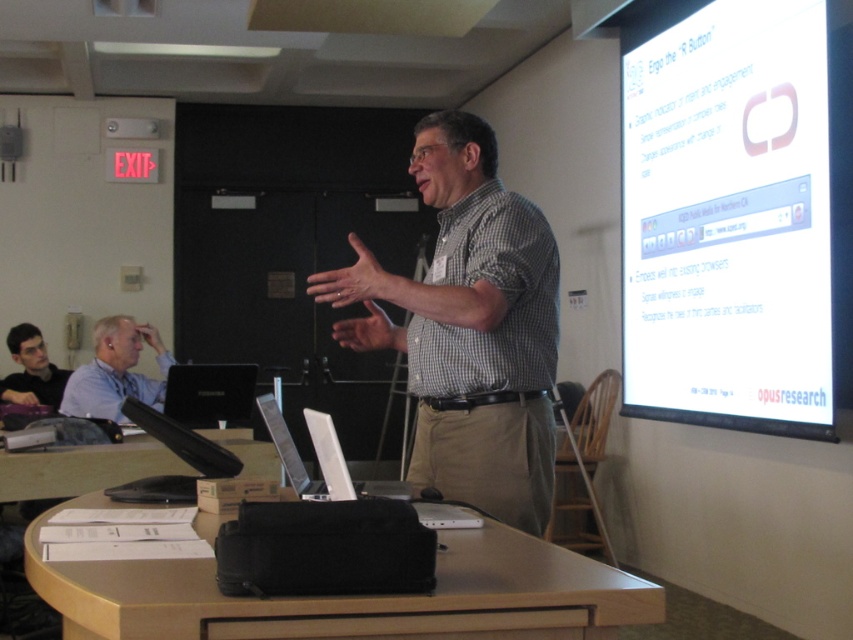
Question: Does checkered shirt at center appear under dark gray shirt at lower left?

Choices:
 (A) no
 (B) yes

Answer: (A)

Question: Which is farther from the checkered shirt at center?

Choices:
 (A) light blue shirt at upper left
 (B) white glossy projection screen at upper right
 (C) dark gray shirt at lower left
 (D) silver metallic laptop at center

Answer: (C)

Question: Is checkered shirt at center positioned before silver metallic laptop at center?

Choices:
 (A) yes
 (B) no

Answer: (B)

Question: Which object appears farthest from the camera in this image?

Choices:
 (A) dark gray shirt at lower left
 (B) silver metallic laptop at center
 (C) white glossy projection screen at upper right
 (D) light blue shirt at upper left

Answer: (A)

Question: Is light blue shirt at upper left to the right of dark gray shirt at lower left from the viewer's perspective?

Choices:
 (A) yes
 (B) no

Answer: (A)

Question: Which of these objects is positioned closest to the white glossy projection screen at upper right?

Choices:
 (A) dark gray shirt at lower left
 (B) silver metallic laptop at center
 (C) light blue shirt at upper left
 (D) checkered shirt at center

Answer: (D)